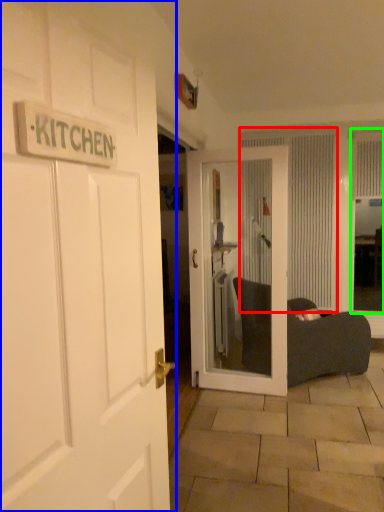
Question: Which object is positioned closest to curtain (highlighted by a red box)? Select from door (highlighted by a blue box) and window screen (highlighted by a green box).

Choices:
 (A) door
 (B) window screen

Answer: (B)